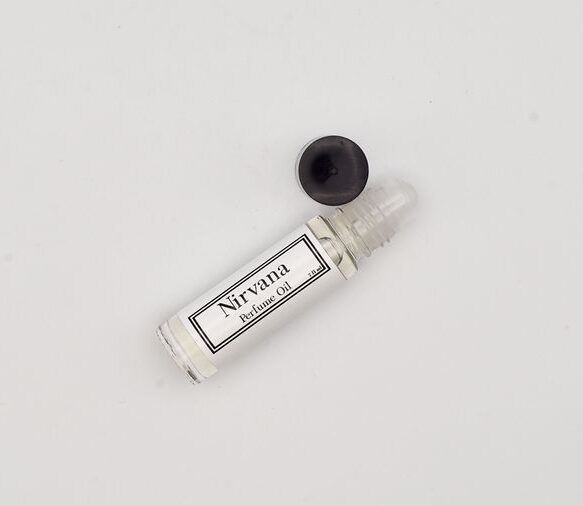
The width and height of the screenshot is (583, 506). I want to click on perfume roller bottle, so click(x=244, y=266).